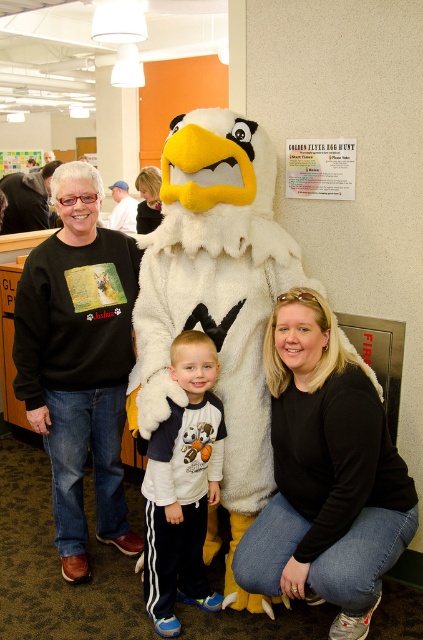
Question: Can you confirm if black matte shirt at lower right is thinner than black sweatshirt at left?

Choices:
 (A) yes
 (B) no

Answer: (B)

Question: Which is nearer to the white fleece sweatshirt at center?

Choices:
 (A) matte black shirt at upper left
 (B) white plush eagle at center

Answer: (B)

Question: Does black sweatshirt at left appear under matte black shirt at upper left?

Choices:
 (A) no
 (B) yes

Answer: (B)

Question: Is white plush eagle at center thinner than matte black shirt at upper left?

Choices:
 (A) yes
 (B) no

Answer: (B)

Question: Which of the following is the closest to the observer?

Choices:
 (A) black sweatshirt at left
 (B) white fleece sweatshirt at center
 (C) white plush eagle at center

Answer: (C)

Question: Based on their relative distances, which object is nearer to the matte black shirt at upper left?

Choices:
 (A) white fleece sweatshirt at center
 (B) black sweatshirt at left

Answer: (B)